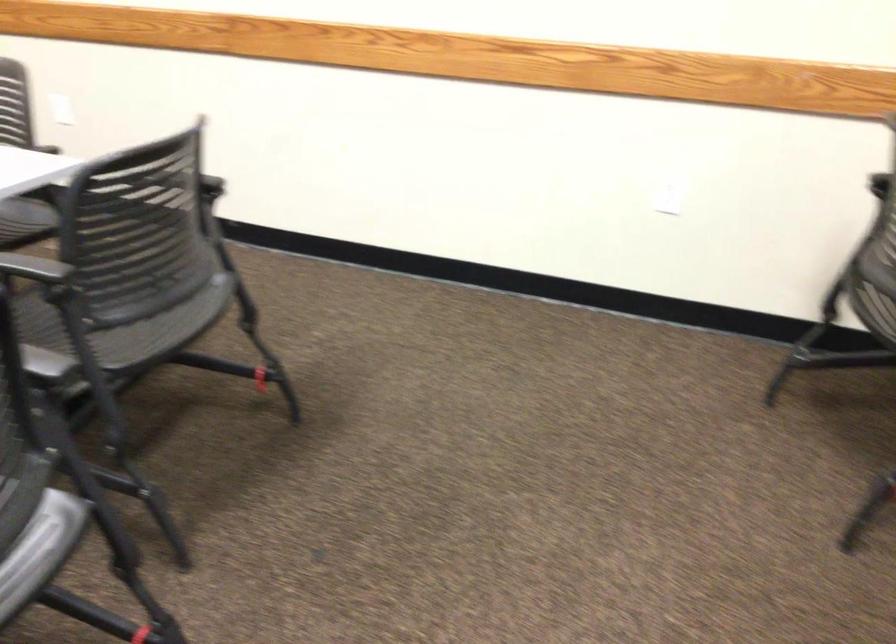
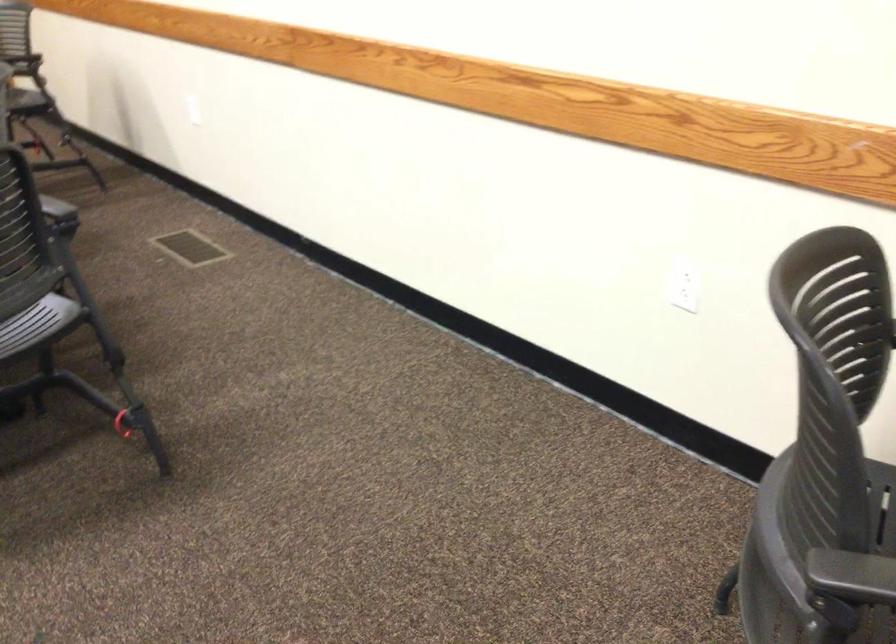
In a continuous first-person perspective shot, in which direction is the camera moving?

The cameraman walked toward right, forward.